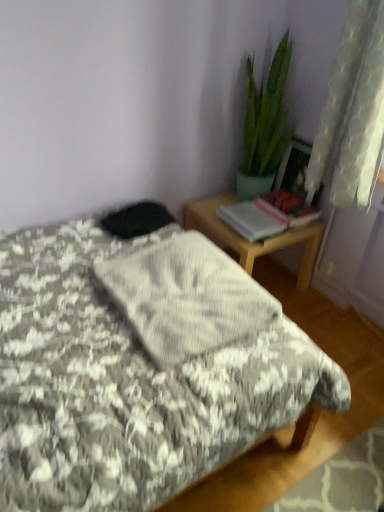
Describe the element at coordinates (126, 385) in the screenshot. I see `fluffy gray blanket at center` at that location.

What is the approximate height of white sheer curtain at upper right?

The height of white sheer curtain at upper right is 31.01 inches.

This screenshot has height=512, width=384. Describe the element at coordinates (352, 111) in the screenshot. I see `white sheer curtain at upper right` at that location.

What are the coordinates of `fluffy gray blanket at center` in the screenshot? It's located at (126, 385).

Would you say wooden desk at right is inside or outside white sheer curtain at upper right?

The correct answer is: outside.

Locate an element on the screen. curtain lying above the wooden desk at right (from the image's perspective) is located at coordinates (352, 111).

From the image's perspective, which is below, wooden desk at right or white sheer curtain at upper right?

From the image's view, wooden desk at right is below.

Considering the relative sizes of fluffy gray blanket at center and wooden desk at right in the image provided, is fluffy gray blanket at center bigger than wooden desk at right?

Yes, fluffy gray blanket at center is bigger than wooden desk at right.

What's the angular difference between fluffy gray blanket at center and wooden desk at right's facing directions?

The angle between the facing direction of fluffy gray blanket at center and the facing direction of wooden desk at right is 180 degrees.

From their relative heights in the image, would you say fluffy gray blanket at center is taller or shorter than wooden desk at right?

In the image, fluffy gray blanket at center appears to be taller than wooden desk at right.

Considering the relative sizes of gray textured blanket at center and green glossy plant at upper right in the image provided, is gray textured blanket at center shorter than green glossy plant at upper right?

Indeed, gray textured blanket at center has a lesser height compared to green glossy plant at upper right.

In the image, is gray textured blanket at center on the left side or the right side of green glossy plant at upper right?

In the image, gray textured blanket at center appears on the left side of green glossy plant at upper right.

Is gray textured blanket at center turned away from green glossy plant at upper right?

No, gray textured blanket at center is not facing away from green glossy plant at upper right.

From the image's perspective, is gray textured blanket at center on green glossy plant at upper right?

No.

From a real-world perspective, does green glossy plant at upper right stand above gray textured blanket at center?

Yes, from a real-world perspective, green glossy plant at upper right is above gray textured blanket at center.

Can you confirm if green glossy plant at upper right is taller than gray textured blanket at center?

Yes, green glossy plant at upper right is taller than gray textured blanket at center.

Is green glossy plant at upper right situated inside gray textured blanket at center or outside?

green glossy plant at upper right lies outside gray textured blanket at center.

Which of these two, green glossy plant at upper right or gray textured blanket at center, is thinner?

Thinner between the two is green glossy plant at upper right.

Does fluffy gray blanket at center have a lesser width compared to gray textured blanket at center?

No, fluffy gray blanket at center is not thinner than gray textured blanket at center.

Does point (150, 466) come behind point (209, 298)?

No, (150, 466) is closer to viewer.

Find the location of a particular element. The height and width of the screenshot is (512, 384). blanket behind the fluffy gray blanket at center is located at coordinates (185, 297).

Does fluffy gray blanket at center appear on the left side of gray textured blanket at center?

Correct, you'll find fluffy gray blanket at center to the left of gray textured blanket at center.

From a real-world perspective, which is physically below, fluffy gray blanket at center or green glossy plant at upper right?

fluffy gray blanket at center.

From the picture: How distant is fluffy gray blanket at center from green glossy plant at upper right?

fluffy gray blanket at center and green glossy plant at upper right are 1.22 meters apart from each other.

Is fluffy gray blanket at center looking in the opposite direction of green glossy plant at upper right?

No.

Locate an element on the screen. The height and width of the screenshot is (512, 384). bed that is in front of the green glossy plant at upper right is located at coordinates (126, 385).

From a real-world perspective, between wooden desk at right and gray textured blanket at center, who is vertically lower?

In real-world perspective, wooden desk at right is lower.

Does point (286, 244) appear closer or farther from the camera than point (257, 308)?

Point (286, 244) appears to be farther away from the viewer than point (257, 308).

Considering the relative sizes of wooden desk at right and gray textured blanket at center in the image provided, is wooden desk at right shorter than gray textured blanket at center?

In fact, wooden desk at right may be taller than gray textured blanket at center.

Measure the distance between wooden desk at right and gray textured blanket at center.

wooden desk at right is 25.07 inches away from gray textured blanket at center.

Where is `desk located on the left of white sheer curtain at upper right`? desk located on the left of white sheer curtain at upper right is located at coordinates (255, 241).

I want to click on bed in front of the wooden desk at right, so click(126, 385).

Considering their positions, is fluffy gray blanket at center positioned closer to white sheer curtain at upper right than gray textured blanket at center?

The object closer to white sheer curtain at upper right is gray textured blanket at center.

From the image, which object appears to be farther from green glossy plant at upper right, fluffy gray blanket at center or gray textured blanket at center?

fluffy gray blanket at center.

From the image, which object appears to be nearer to fluffy gray blanket at center, wooden desk at right or gray textured blanket at center?

gray textured blanket at center is closer to fluffy gray blanket at center.

Looking at the image, which one is located further to wooden desk at right, gray textured blanket at center or white sheer curtain at upper right?

gray textured blanket at center is positioned further to the anchor wooden desk at right.

Looking at this image, looking at the image, which one is located closer to green glossy plant at upper right, fluffy gray blanket at center or white sheer curtain at upper right?

white sheer curtain at upper right is closer to green glossy plant at upper right.

In the scene shown: Estimate the real-world distances between objects in this image. Which object is further from green glossy plant at upper right, white sheer curtain at upper right or gray textured blanket at center?

The object further to green glossy plant at upper right is gray textured blanket at center.

Estimate the real-world distances between objects in this image. Which object is further from gray textured blanket at center, green glossy plant at upper right or white sheer curtain at upper right?

green glossy plant at upper right is positioned further to the anchor gray textured blanket at center.

When comparing their distances from wooden desk at right, does white sheer curtain at upper right or gray textured blanket at center seem further?

gray textured blanket at center.

Locate an element on the screen. Image resolution: width=384 pixels, height=512 pixels. curtain between fluffy gray blanket at center and green glossy plant at upper right from front to back is located at coordinates (352, 111).

Where is `houseplant between fluffy gray blanket at center and wooden desk at right from front to back`? The width and height of the screenshot is (384, 512). houseplant between fluffy gray blanket at center and wooden desk at right from front to back is located at coordinates (265, 126).

This screenshot has width=384, height=512. Find the location of `curtain located between gray textured blanket at center and wooden desk at right in the depth direction`. curtain located between gray textured blanket at center and wooden desk at right in the depth direction is located at coordinates (352, 111).

The image size is (384, 512). In order to click on blanket situated between fluffy gray blanket at center and white sheer curtain at upper right from left to right in this screenshot , I will do `click(185, 297)`.